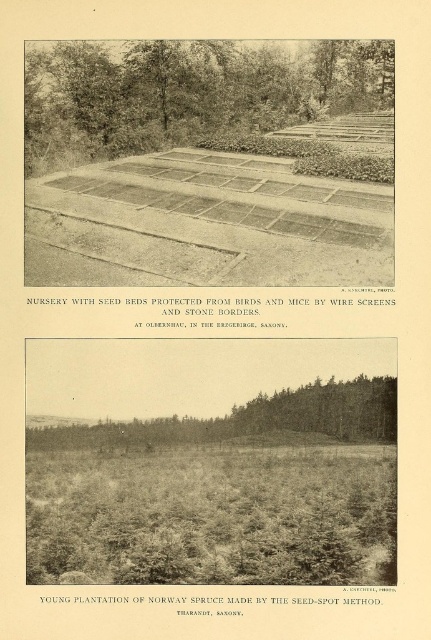
Is point (187, 196) behind point (137, 125)?

No, (187, 196) is closer to viewer.

Is brown gravel dirt track at center wider than green leafy tree at upper center?

Incorrect, brown gravel dirt track at center's width does not surpass green leafy tree at upper center's.

Identify the location of brown gravel dirt track at center. The width and height of the screenshot is (431, 640). (219, 220).

The image size is (431, 640). I want to click on brown gravel dirt track at center, so click(219, 220).